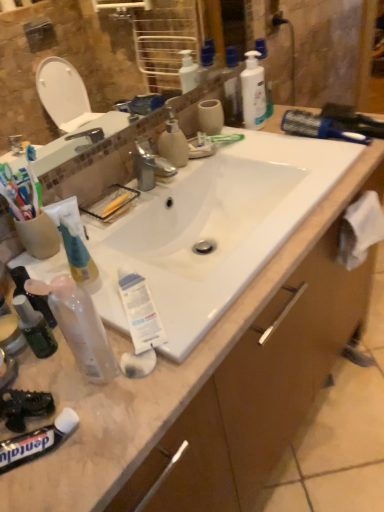
Where is `free space to the back side of black matte toothpaste at lower left, acting as the third toothpaste starting from the back`? Image resolution: width=384 pixels, height=512 pixels. free space to the back side of black matte toothpaste at lower left, acting as the third toothpaste starting from the back is located at coordinates (59, 368).